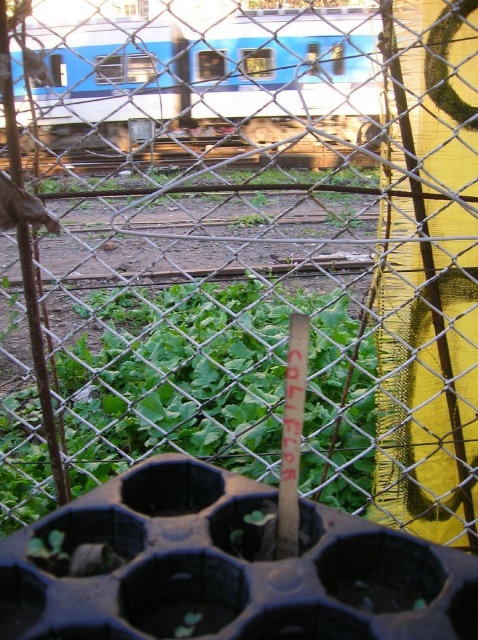
You are standing at the point marked as point (218, 387) in the image. What do you see directly in front of you?

You see a green leafy plant at center directly in front of you at point (218, 387).

You are standing behind the chain link fence and see the green leafy plant at center and the blue painted metal train at upper center. Which object is positioned to the right side?

The green leafy plant at center is positioned to the right of the blue painted metal train at upper center.